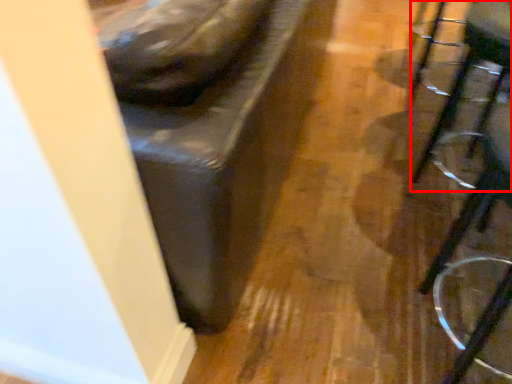
Question: In this image, where is swivel chair (annotated by the red box) located relative to furniture?

Choices:
 (A) left
 (B) right

Answer: (B)